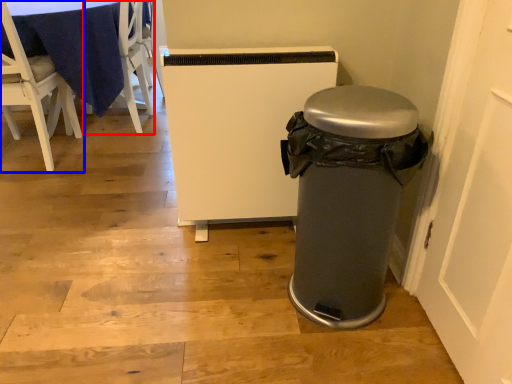
Question: Which point is closer to the camera, chair (highlighted by a red box) or chair (highlighted by a blue box)?

Choices:
 (A) chair
 (B) chair

Answer: (B)